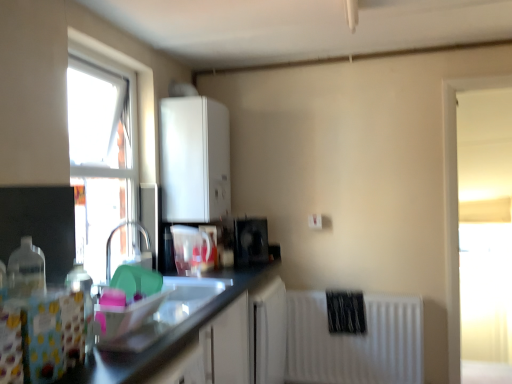
Question: Based on their sizes in the image, would you say transparent glass window at upper left, the first window viewed from the left, is bigger or smaller than black glossy speaker at center, which ranks as the first appliance in back-to-front order?

Choices:
 (A) big
 (B) small

Answer: (A)

Question: Is point (93, 220) positioned closer to the camera than point (266, 246)?

Choices:
 (A) closer
 (B) farther

Answer: (A)

Question: Estimate the real-world distances between objects in this image. Which object is farther from the white matte cabinet at upper center?

Choices:
 (A) black glossy speaker at center, which ranks as the first appliance in back-to-front order
 (B) transparent glass window at upper left, the first window viewed from the left
 (C) translucent plastic bottle at left
 (D) matte black sink at center
 (E) white matte radiator at lower right

Answer: (C)

Question: Which object is the farthest from the black glossy speaker at center, the 2th appliance when ordered from front to back?

Choices:
 (A) white matte cabinet at upper center
 (B) transparent glass window at upper left, which ranks as the 2th window in right-to-left order
 (C) translucent plastic bottle at left
 (D) matte black sink at center
 (E) transparent glass window at right, which is the 1th window in back-to-front order

Answer: (C)